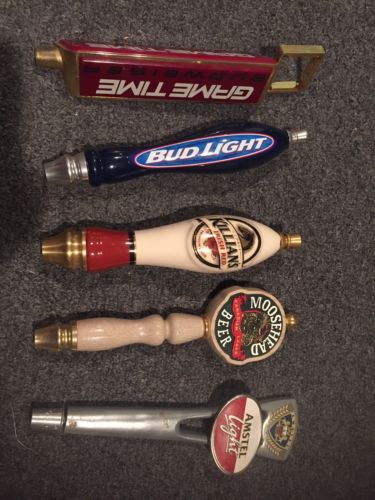
This screenshot has height=500, width=375. I want to click on collectible bottle openers, so click(279, 419), click(258, 321), click(235, 220), click(220, 148), click(181, 86).